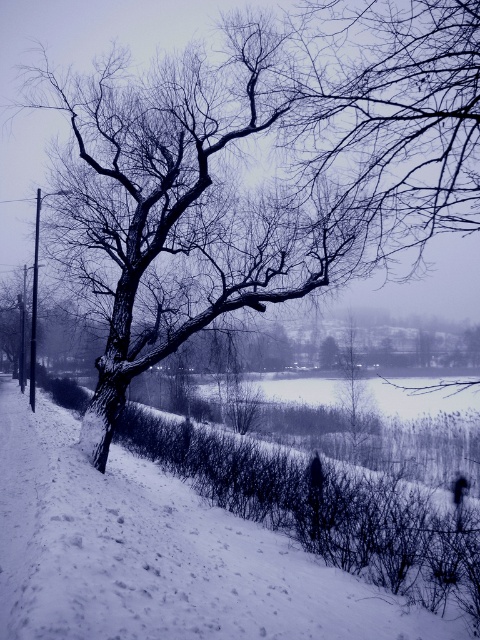
You are standing at the point with coordinates point [287,150] in the winter scene. What object are you directly facing?

You are directly facing the bare wood tree at center because the point [287,150] corresponds to it.

You are an artist planning to paint this winter scene. You want to ensure the bare wood tree at center and the white fluffy snow at center are proportionally accurate. Based on the scene, which object should you depict as taller?

The bare wood tree at center should be depicted as taller than the white fluffy snow at center since the description states that the bare wood tree at center has a greater height compared to white fluffy snow at center.